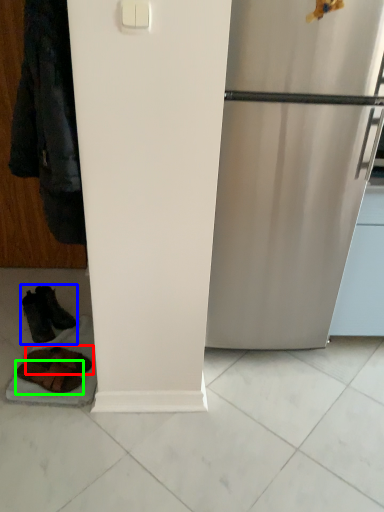
Question: Which object is positioned farthest from footwear (highlighted by a red box)? Select from footwear (highlighted by a blue box) and footwear (highlighted by a green box).

Choices:
 (A) footwear
 (B) footwear

Answer: (A)